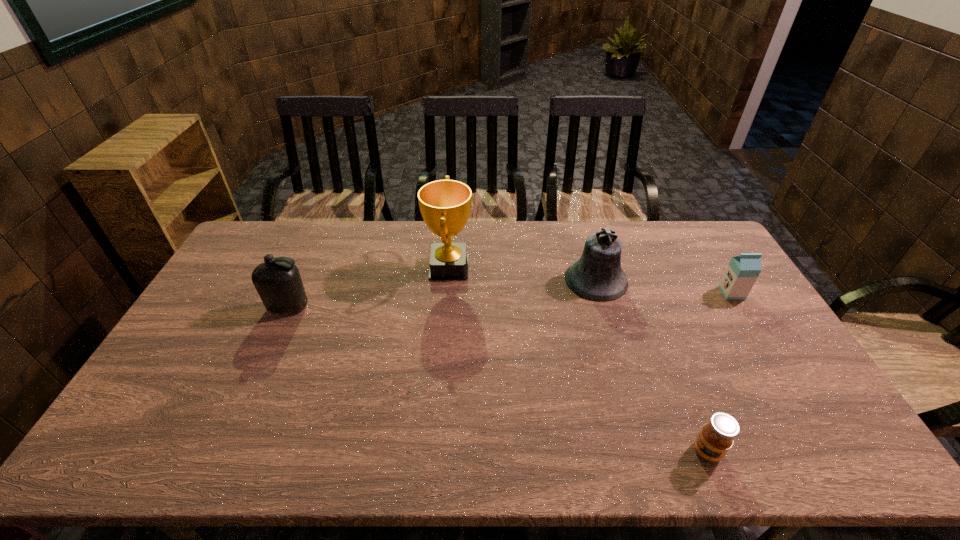
Find the location of a particular element. This screenshot has width=960, height=540. free spot located 0.080m on the left of the bell is located at coordinates (541, 280).

Where is `vacant point located on the left of the second shortest object`? vacant point located on the left of the second shortest object is located at coordinates (670, 293).

Find the location of `vacant space situated 0.150m on the front-facing side of the honey`. vacant space situated 0.150m on the front-facing side of the honey is located at coordinates (630, 451).

Locate an element on the screen. free point located on the front-facing side of the honey is located at coordinates (612, 451).

Where is `vacant space located on the front-facing side of the honey`? This screenshot has width=960, height=540. vacant space located on the front-facing side of the honey is located at coordinates (570, 451).

Find the location of a particular element. The image size is (960, 540). award that is at the far edge is located at coordinates (445, 205).

What are the coordinates of `bell at the far edge` in the screenshot? It's located at (597, 276).

This screenshot has width=960, height=540. Identify the location of object that is positioned at the near edge. (716, 437).

At what (x,y) coordinates should I click in order to perform the action: click on object positioned at the right edge. Please return your answer as a coordinate pair (x, y). This screenshot has height=540, width=960. Looking at the image, I should click on (742, 271).

Locate an element on the screen. The height and width of the screenshot is (540, 960). vacant space at the far edge of the desktop is located at coordinates click(x=416, y=251).